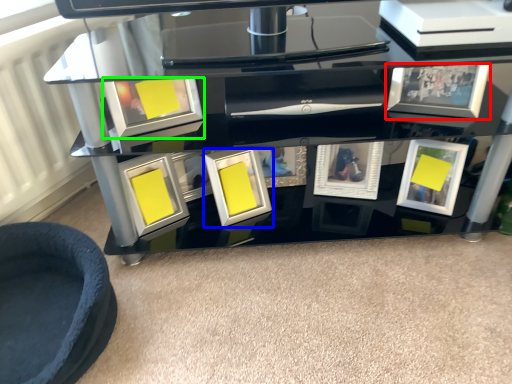
Question: Based on their relative distances, which object is farther from picture frame (highlighted by a red box)? Choose from picture frame (highlighted by a blue box) and picture frame (highlighted by a green box).

Choices:
 (A) picture frame
 (B) picture frame

Answer: (B)